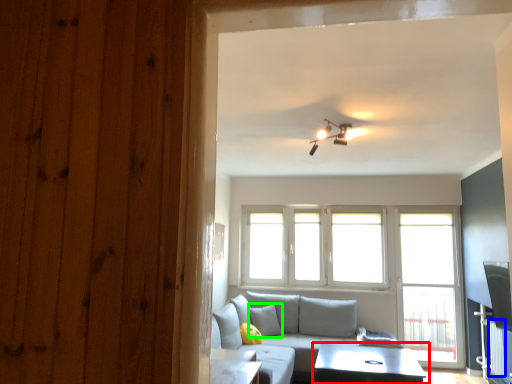
Question: Which object is positioned farthest from table (highlighted by a red box)? Select from curtain (highlighted by a blue box) and pillow (highlighted by a green box).

Choices:
 (A) curtain
 (B) pillow

Answer: (B)